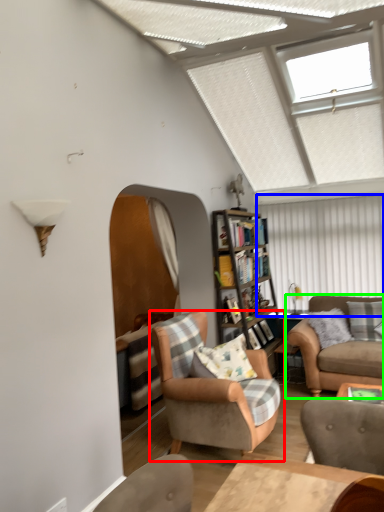
Question: Which object is positioned closest to chair (highlighted by a red box)? Select from shutter (highlighted by a blue box) and studio couch (highlighted by a green box).

Choices:
 (A) shutter
 (B) studio couch

Answer: (B)